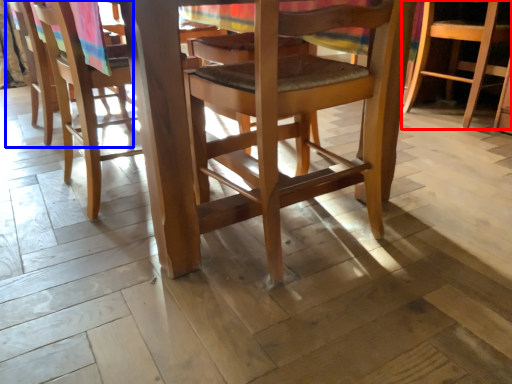
Question: Which object appears closest to the camera in this image, chair (highlighted by a red box) or chair (highlighted by a blue box)?

Choices:
 (A) chair
 (B) chair

Answer: (B)